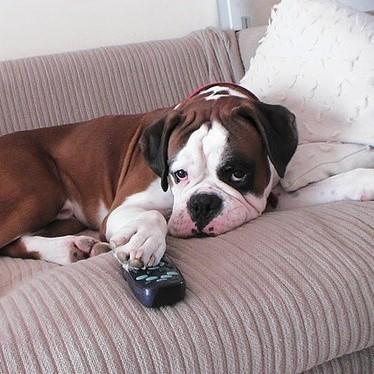
You are a GUI agent. You are given a task and a screenshot of the screen. Output one action in this format:
    pyautogui.click(x=<x>, y=<y>)
    Task: Click on the white throw pillow upper  right corner of couch
    The width and height of the screenshot is (374, 374).
    Given the screenshot: What is the action you would take?
    pyautogui.click(x=346, y=67)